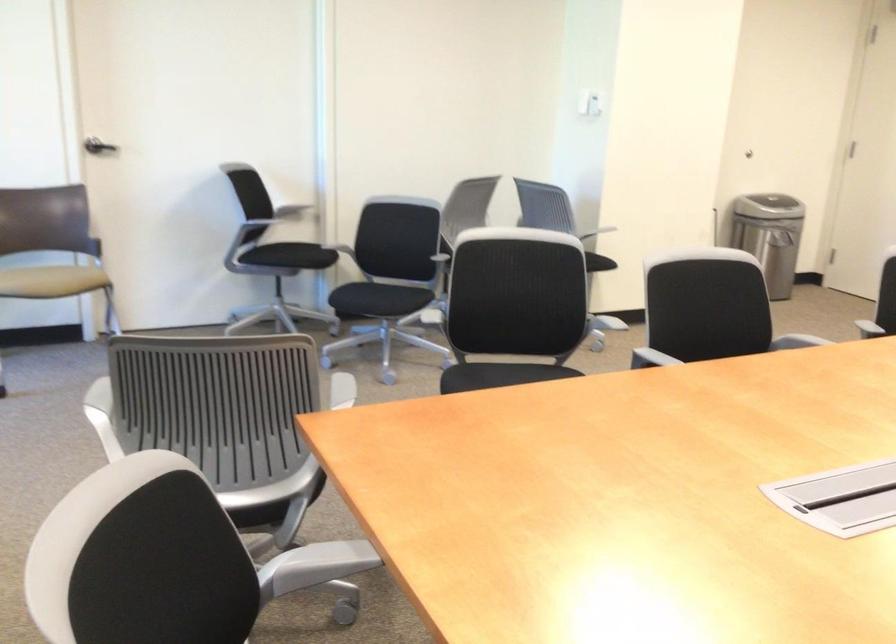
Find where to turn the dark door handle. Please return your answer as a coordinate pair (x, y).

(99, 147)